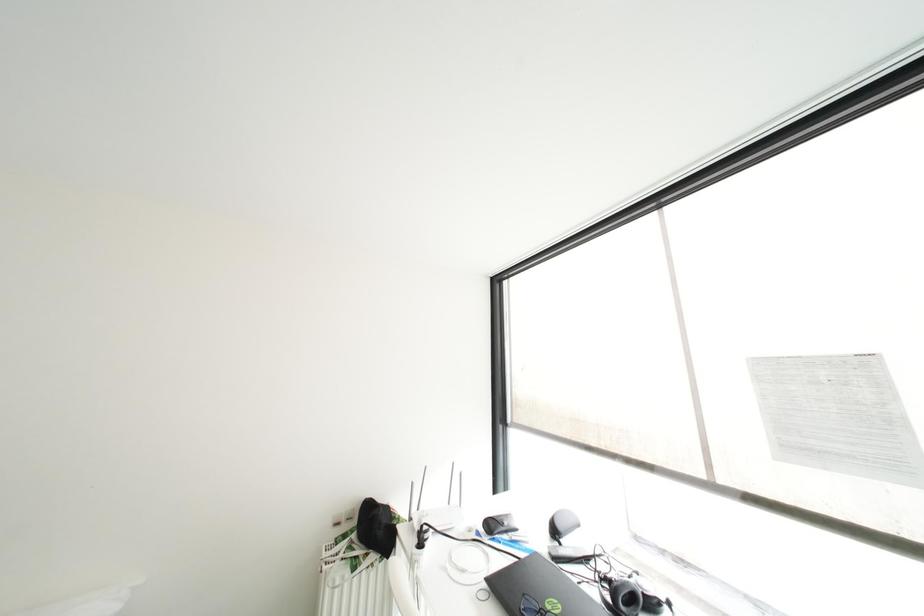
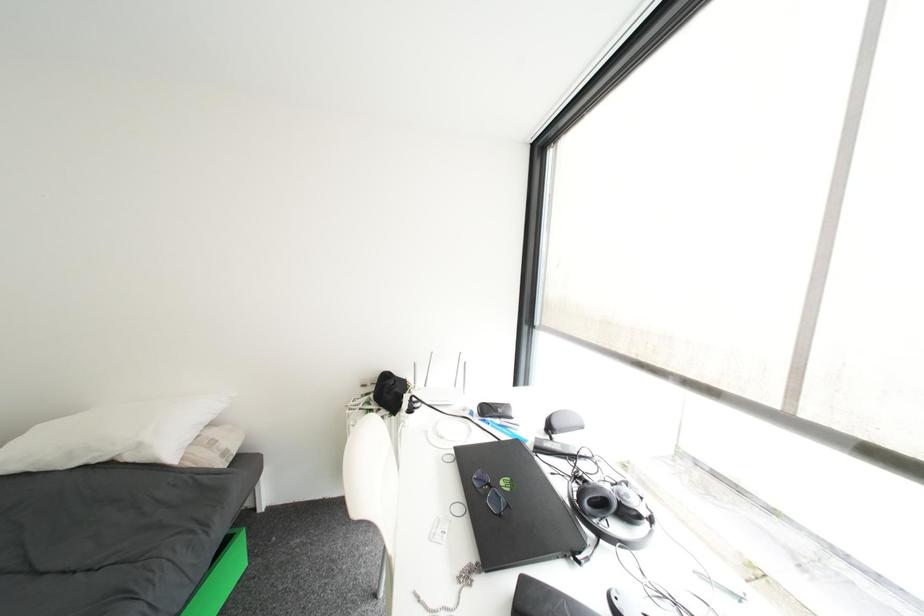
The first image is from the beginning of the video and the second image is from the end. How did the camera likely rotate when shooting the video?

The camera rotated toward left-down.